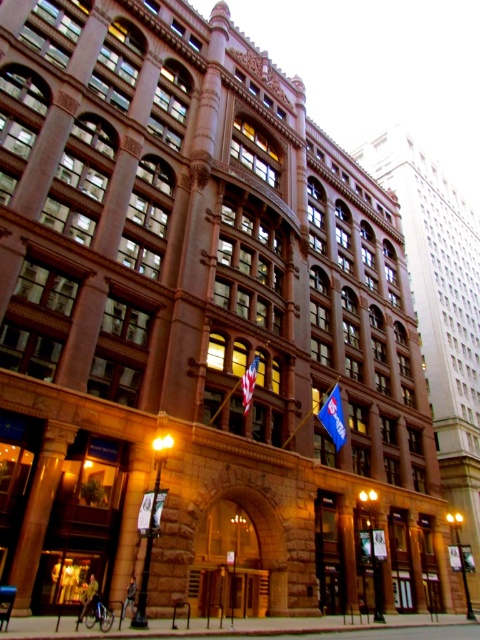
Question: Is brown stone pillar at lower left positioned behind blue fabric flag at lower right?

Choices:
 (A) no
 (B) yes

Answer: (A)

Question: Does brown stone pillar at lower left lie in front of american flag at center?

Choices:
 (A) yes
 (B) no

Answer: (A)

Question: Is brown stone pillar at lower left thinner than american flag at center?

Choices:
 (A) yes
 (B) no

Answer: (B)

Question: Estimate the real-world distances between objects in this image. Which object is farther from the brown stone pillar at lower left?

Choices:
 (A) american flag at center
 (B) blue fabric flag at lower right

Answer: (B)

Question: Which point appears closest to the camera in this image?

Choices:
 (A) (48, 497)
 (B) (244, 380)
 (C) (335, 422)

Answer: (A)

Question: Which point is farther from the camera taking this photo?

Choices:
 (A) (21, 531)
 (B) (342, 442)
 (C) (253, 385)

Answer: (B)